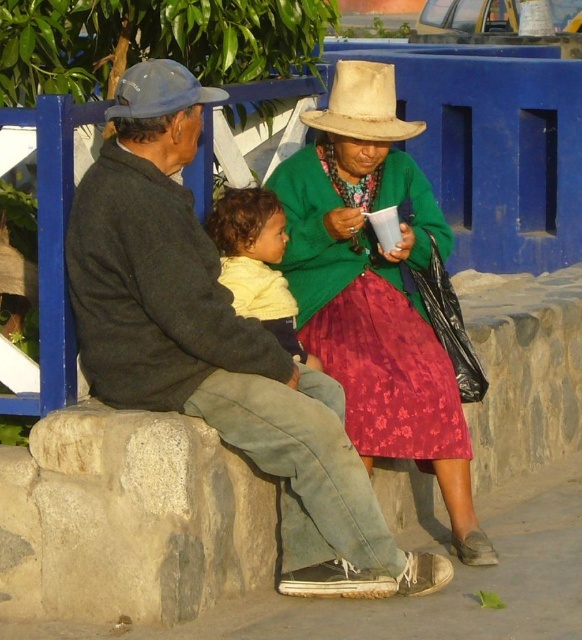
You are a photographer trying to capture a closeup of the soft yellow sweater at center and the natural straw cowboy hat at center. Since you want both items to be in focus, you need to know their sizes relative to each other. Which one is taller?

The soft yellow sweater at center is taller than natural straw cowboy hat at center.

You are an artist sketching this scene and want to ensure proportions are accurate. Which object, the soft yellow sweater at center or the matte blue cowboy hat at upper left, should you draw taller in your sketch?

The soft yellow sweater at center should be drawn taller because it has a greater height compared to the matte blue cowboy hat at upper left according to the description.